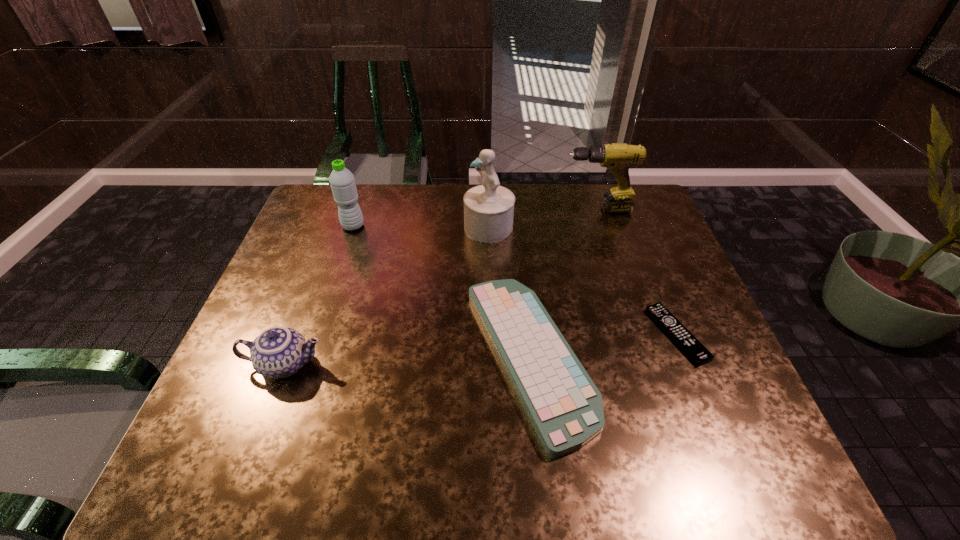
Identify the location of vacant position located 0.140m on the handle side of the drill. The image size is (960, 540). (517, 210).

The width and height of the screenshot is (960, 540). Identify the location of free space located 0.130m on the handle side of the drill. pyautogui.click(x=520, y=210).

This screenshot has width=960, height=540. What are the coordinates of `free space located on the back of the water bottle` in the screenshot? It's located at (360, 206).

Find the location of `vacant space located from the spout of the fourth tallest object`. vacant space located from the spout of the fourth tallest object is located at coordinates (406, 364).

Locate an element on the screen. vacant space located on the right of the computer keyboard is located at coordinates (698, 359).

Identify the location of free region located 0.220m on the back of the shortest object. Image resolution: width=960 pixels, height=540 pixels. pos(642,250).

Where is `figurine that is at the far edge`? The height and width of the screenshot is (540, 960). figurine that is at the far edge is located at coordinates (488, 208).

At what (x,y) coordinates should I click in order to perform the action: click on drill at the far edge. Please return your answer as a coordinate pair (x, y). This screenshot has height=540, width=960. Looking at the image, I should click on (617, 157).

Locate an element on the screen. This screenshot has width=960, height=540. water bottle located at the far edge is located at coordinates (342, 182).

Find the location of a particular element. object at the near edge is located at coordinates (565, 407).